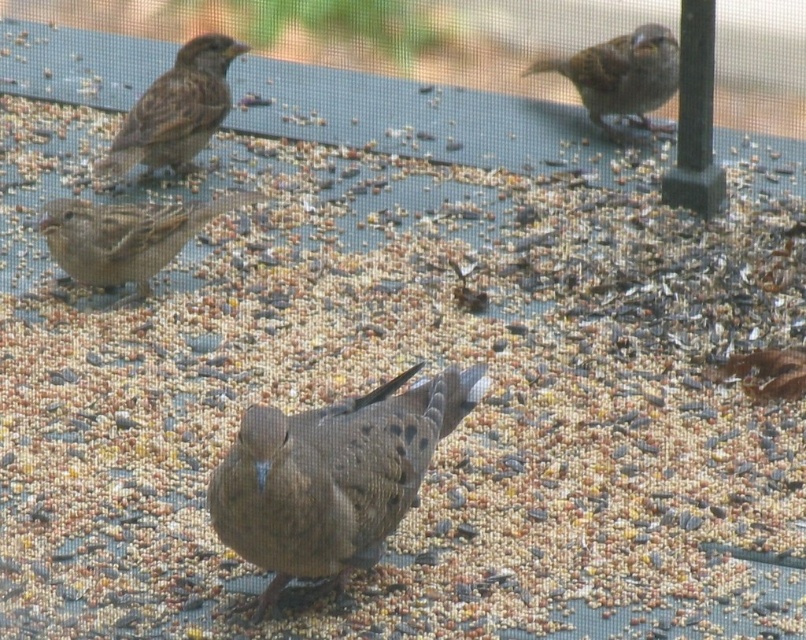
Is point (115, 282) farther from camera compared to point (642, 120)?

No.

Is brown matte sparrow at left wider than brown matte sparrow at upper right?

Correct, the width of brown matte sparrow at left exceeds that of brown matte sparrow at upper right.

Is point (192, 218) behind point (611, 54)?

No, it is not.

Find the location of a particular element. brown matte sparrow at left is located at coordinates (125, 236).

Does brown speckled sparrow at center have a lesser height compared to brown feathered sparrow at upper left?

No, brown speckled sparrow at center is not shorter than brown feathered sparrow at upper left.

Does brown speckled sparrow at center appear over brown feathered sparrow at upper left?

No, brown speckled sparrow at center is not above brown feathered sparrow at upper left.

At what (x,y) coordinates should I click in order to perform the action: click on brown speckled sparrow at center. Please return your answer as a coordinate pair (x, y). Looking at the image, I should click on (333, 476).

This screenshot has height=640, width=806. What are the coordinates of `brown speckled sparrow at center` in the screenshot? It's located at (333, 476).

Who is taller, brown matte sparrow at left or brown feathered sparrow at upper left?

Standing taller between the two is brown feathered sparrow at upper left.

Find the location of `brown matte sparrow at left`. brown matte sparrow at left is located at coordinates (125, 236).

At what (x,y) coordinates should I click in order to perform the action: click on brown matte sparrow at left. Please return your answer as a coordinate pair (x, y). Looking at the image, I should click on (125, 236).